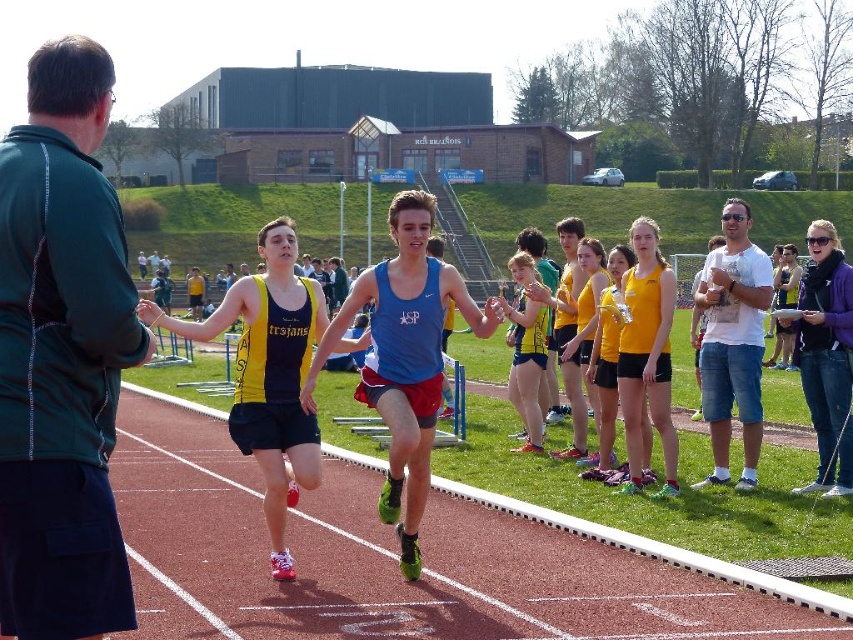
Question: Observing the image, what is the correct spatial positioning of matte blue tank top at center in reference to yellow matte tank top at center?

Choices:
 (A) right
 (B) left

Answer: (B)

Question: Estimate the real-world distances between objects in this image. Which object is farther from the matte blue tank top at center?

Choices:
 (A) yellow matte tank top at center
 (B) blue matte tank top at center
 (C) rubberized red track at center

Answer: (A)

Question: Which object appears farthest from the camera in this image?

Choices:
 (A) matte blue tank top at center
 (B) rubberized red track at center
 (C) yellow matte tank top at center
 (D) blue matte tank top at center

Answer: (C)

Question: Which point is closer to the camera?

Choices:
 (A) (633, 285)
 (B) (357, 460)

Answer: (A)

Question: Does blue matte tank top at center appear over matte blue tank top at center?

Choices:
 (A) no
 (B) yes

Answer: (A)

Question: Can you confirm if yellow matte tank top at center is wider than rubberized red track at center?

Choices:
 (A) yes
 (B) no

Answer: (B)